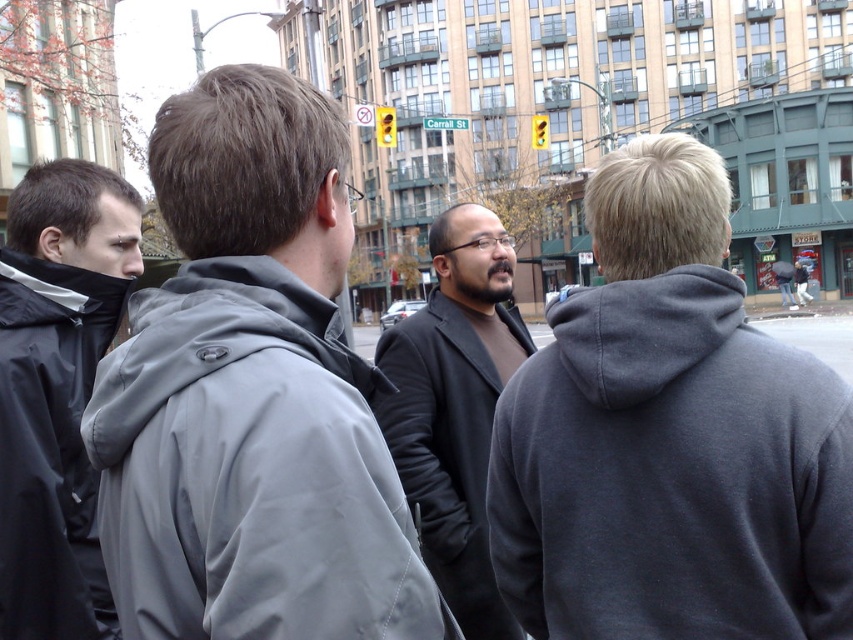
You are standing on the city street where the group is gathered. You need to locate the dark gray jacket at left. Based on its coordinates, is it closer to the top or bottom of the image?

The dark gray jacket at left is located at point 0.068 on the vertical axis, which places it closer to the bottom of the image.

You are a delivery person standing at the dark gray hoodie at right. You need to deliver a package to the gray synthetic jacket at upper left. The delivery robot you are using has a maximum range of 10 feet. Can you deliver the package without leaving the robot?

The distance between the dark gray hoodie at right and the gray synthetic jacket at upper left is 13.94 feet, which exceeds the robot s 10 feet range. You cannot deliver the package without leaving the robot.

You are standing at the point with coordinates point [115,307] and want to walk to the point with coordinates point [459,496]. Which direction should you move to reach your destination?

You should move backward because point [115,307] is in front of point [459,496].